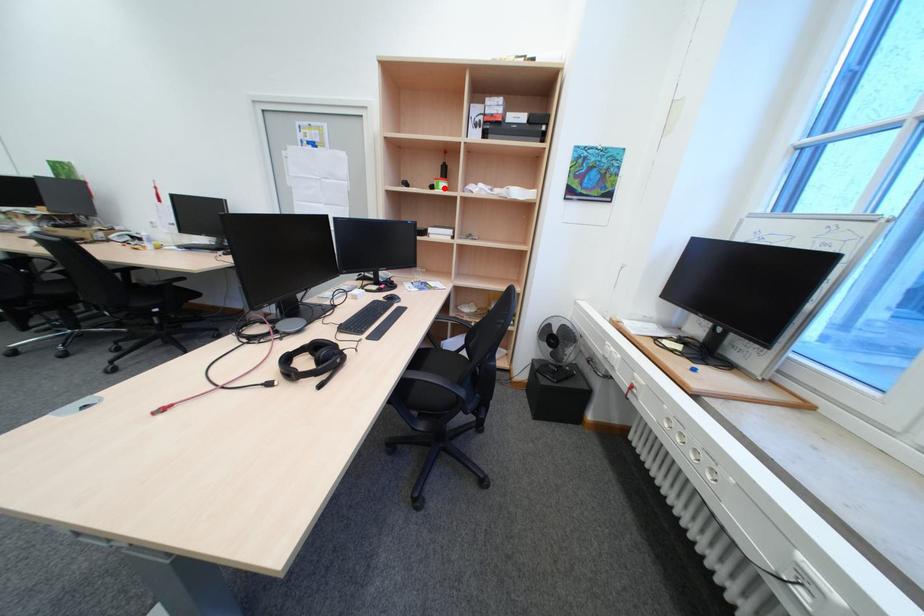
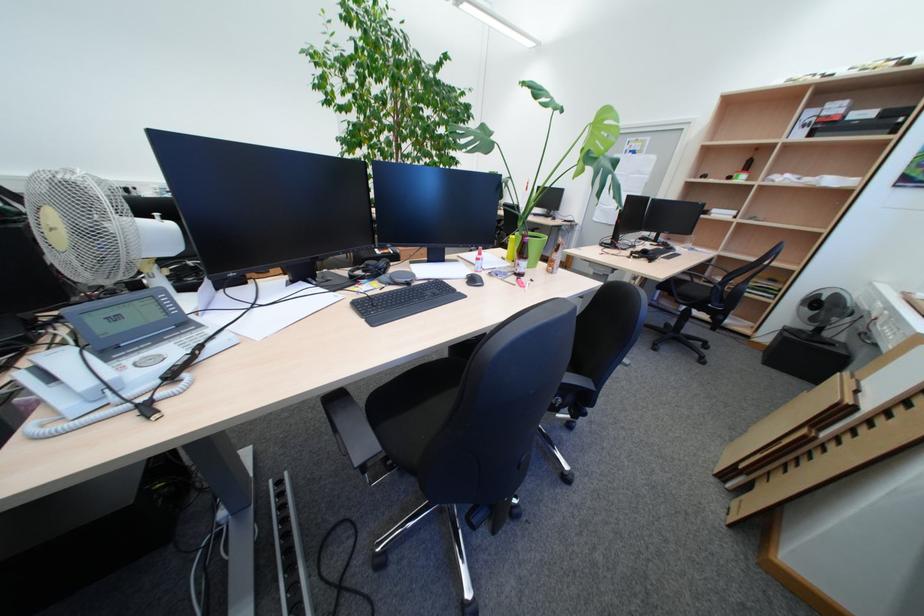
Question: I am providing you with two images of the same scene from different viewpoints. Image1 has a red point marked. In image2, the corresponding 3D location appears at what relative position? Reply with the corresponding letter.

Choices:
 (A) Closer
 (B) Farther

Answer: (B)